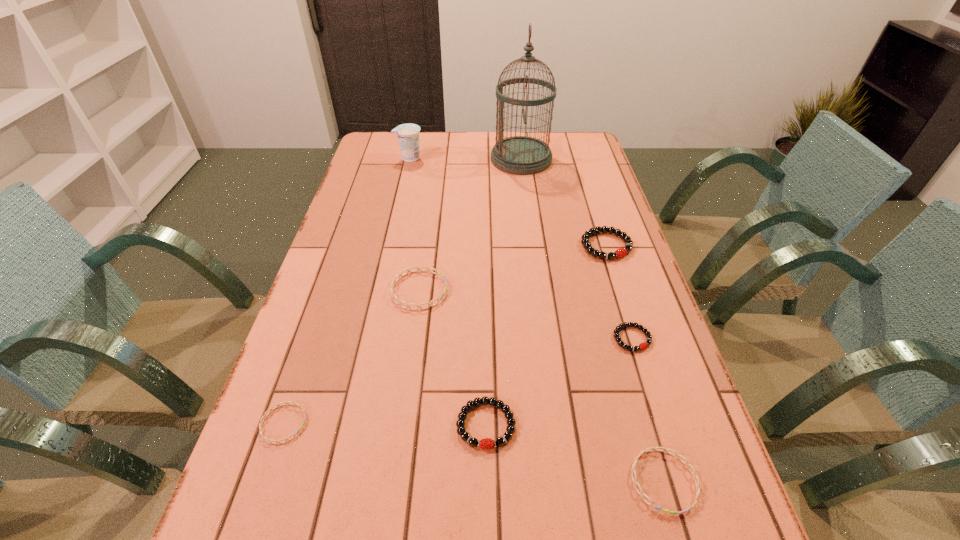
Find the location of a particular element. The width and height of the screenshot is (960, 540). vacant space at the left edge of the desktop is located at coordinates (363, 205).

Where is `vacant space at the right edge of the desktop`? Image resolution: width=960 pixels, height=540 pixels. vacant space at the right edge of the desktop is located at coordinates (688, 458).

In the image, there is a desktop. At what (x,y) coordinates should I click in order to perform the action: click on vacant space at the far left corner. Please return your answer as a coordinate pair (x, y). Looking at the image, I should click on (391, 154).

Where is `free space between the third bracelet from left to right and the nearest blue bracelet`? This screenshot has width=960, height=540. free space between the third bracelet from left to right and the nearest blue bracelet is located at coordinates (575, 453).

This screenshot has width=960, height=540. What are the coordinates of `unoccupied area between the farthest black bracelet and the rightmost blue bracelet` in the screenshot? It's located at (636, 363).

Identify the location of free spot between the second biggest black bracelet and the second tallest object. (447, 291).

Image resolution: width=960 pixels, height=540 pixels. What are the coordinates of `empty space that is in between the blue yogurt and the tallest object` in the screenshot? It's located at (466, 159).

The height and width of the screenshot is (540, 960). I want to click on free spot between the farthest black bracelet and the second tallest object, so coord(508,202).

I want to click on free space between the second smallest black bracelet and the farthest black bracelet, so click(x=546, y=335).

Identify the location of free space between the biggest blue bracelet and the rightmost blue bracelet. (541, 386).